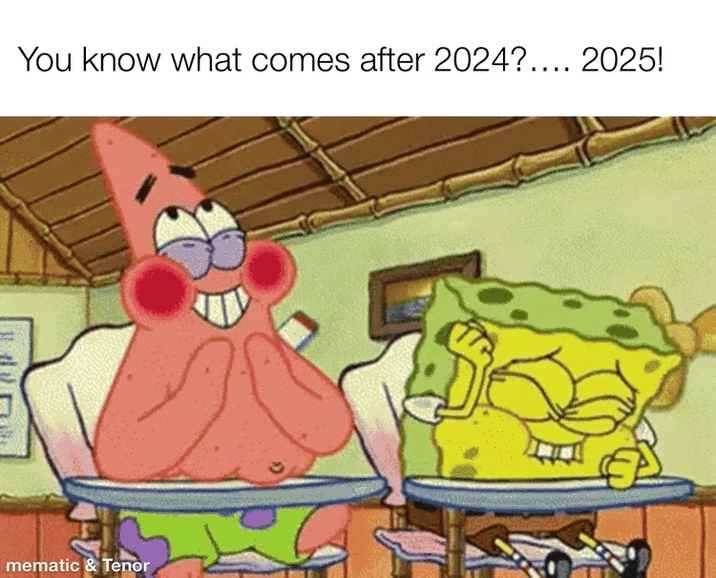
Where is `desks`? The height and width of the screenshot is (578, 716). desks is located at coordinates (251, 490), (574, 496).